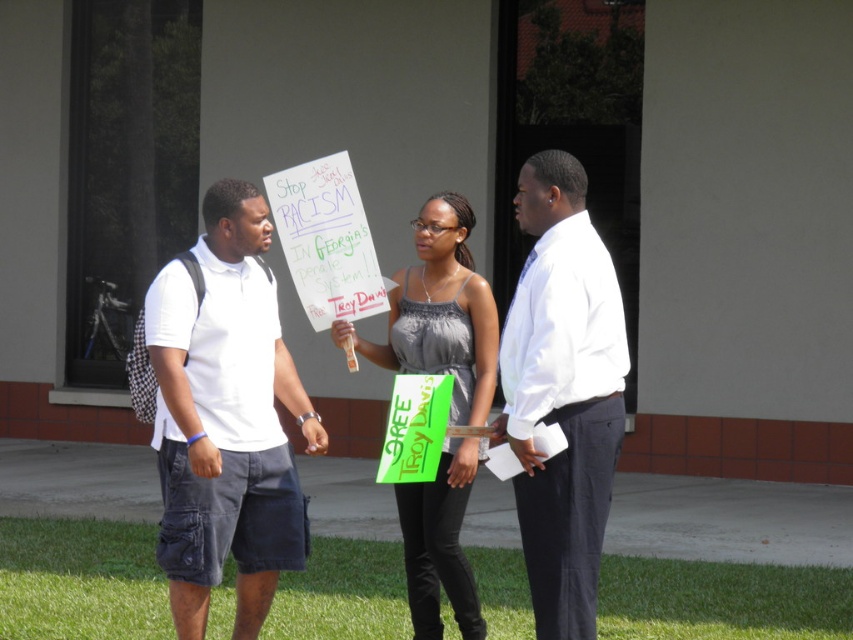
You are a photographer trying to capture a photo of the two protesters holding signs. You want to ensure both the white cotton polo shirt at left and the matte gray tank top at center are clearly visible in the frame. Based on their positions, which protester should you position closer to the camera to ensure their sign is in focus?

The white cotton polo shirt at left is to the left of matte gray tank top at center. To ensure both signs are in focus, position the protester with the white cotton polo shirt at left closer to the camera since they are already positioned to the left and further away from the center protester. This will help maintain clarity for both signs in the photo.